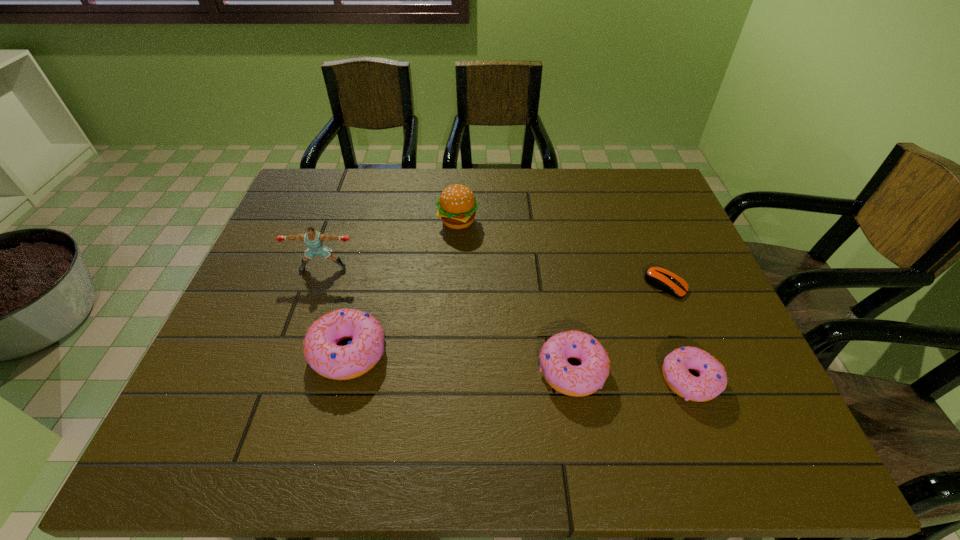
To make them evenly spaced by inserting another doughnut among them, please locate a free space for this new doughnut. Please provide its 2D coordinates. Your answer should be formatted as a tuple, i.e. [(x, y)], where the tuple contains the x and y coordinates of a point satisfying the conditions above.

[(459, 361)]